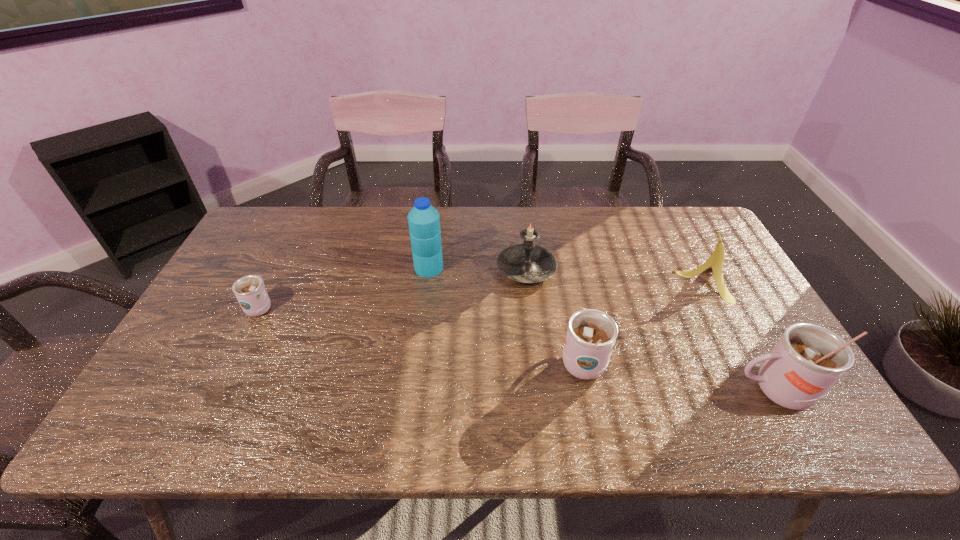
Identify which object is the nearest to the shortest cup. Please provide its 2D coordinates. Your answer should be formatted as a tuple, i.e. [(x, y)], where the tuple contains the x and y coordinates of a point satisfying the conditions above.

[(424, 221)]

The width and height of the screenshot is (960, 540). I want to click on the third closest cup relative to the fifth tallest object, so click(x=250, y=292).

Identify the location of cup object that ranks as the closest to the rightmost cup. The height and width of the screenshot is (540, 960). (591, 334).

The image size is (960, 540). Identify the location of free location that satisfies the following two spatial constraints: 1. on the side with the handle of the second object from left to right; 2. on the left side of the farthest cup. (279, 268).